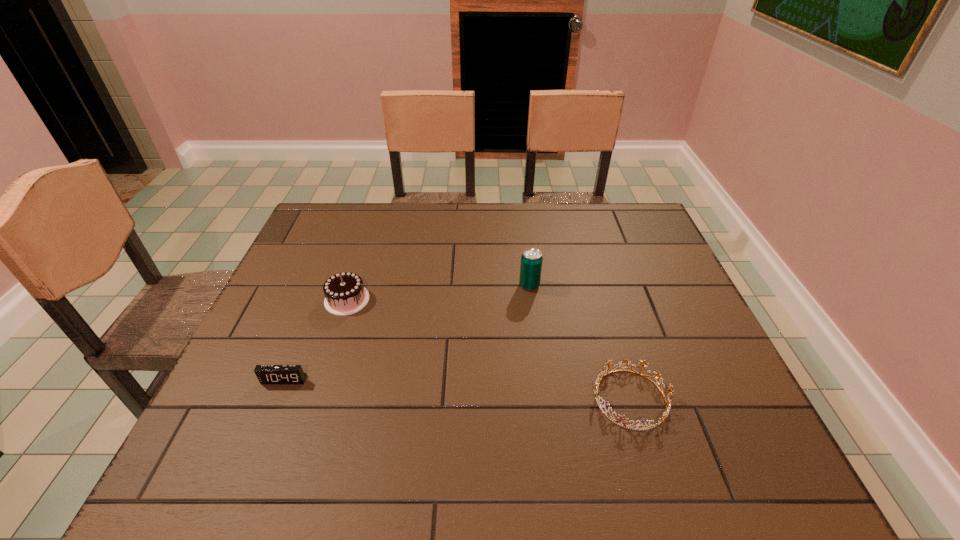
In order to click on object that is the third closest to the rightmost object in this screenshot , I will do `click(267, 374)`.